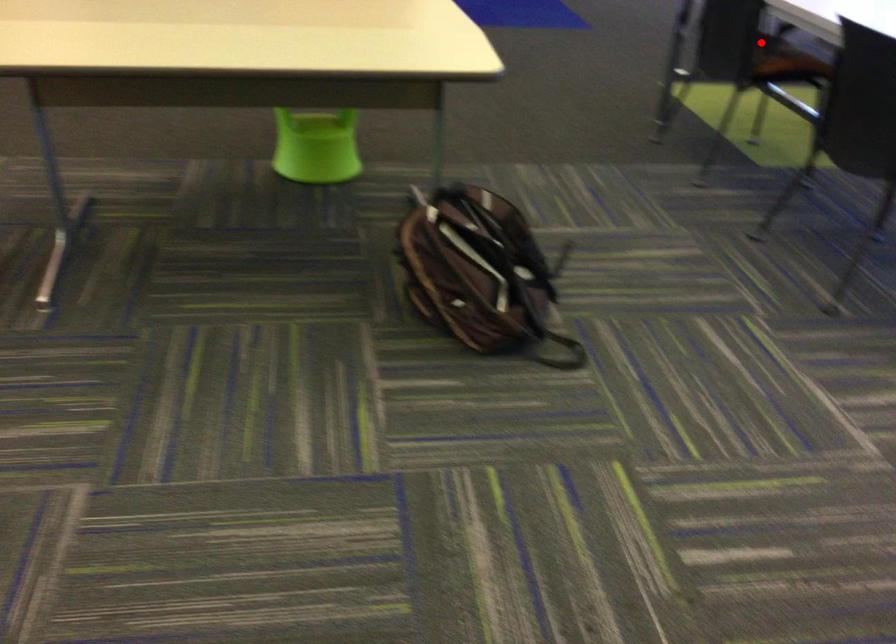
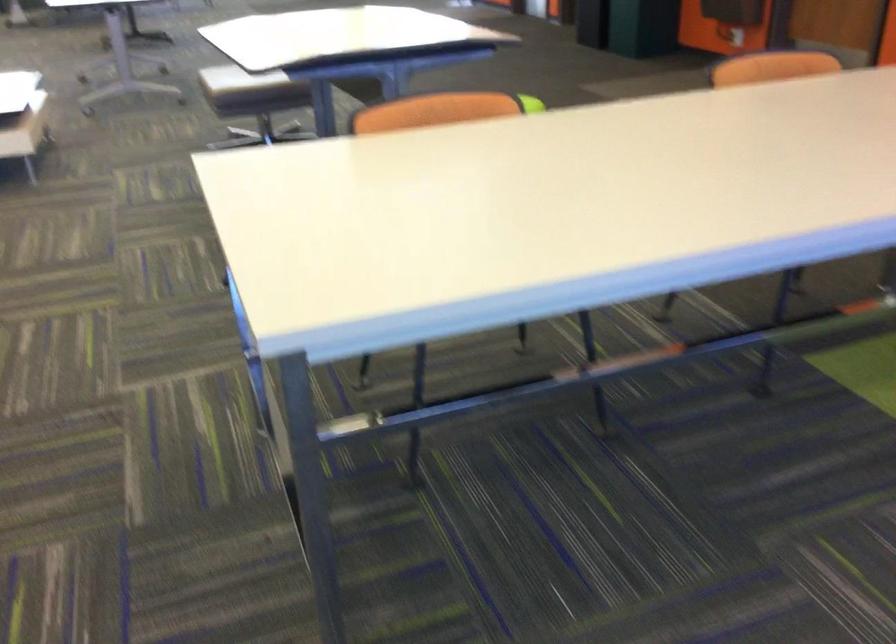
Question: I am providing you with two images of the same scene from different viewpoints. A red point is marked on the first image. Is the red point's position out of view in image 2?

Choices:
 (A) Yes
 (B) No

Answer: (A)